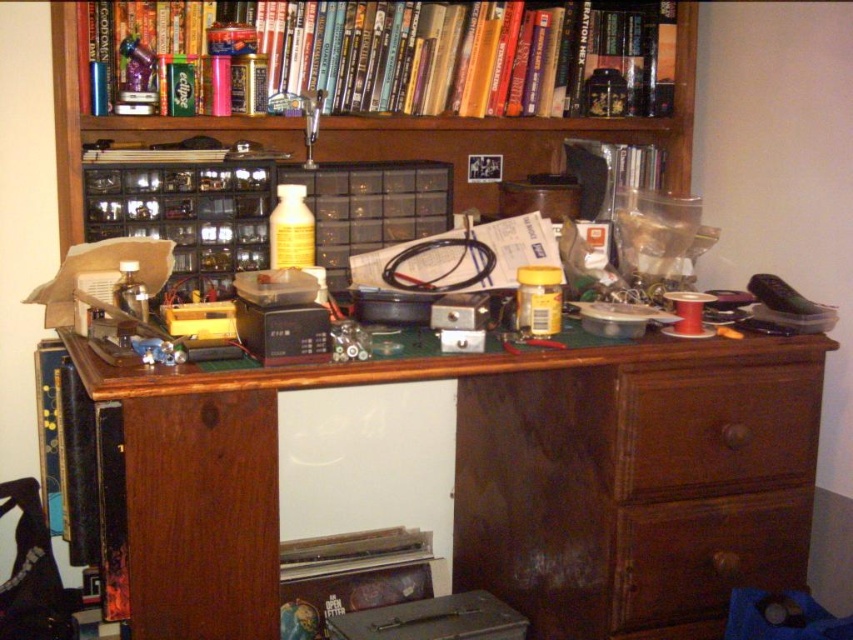
You are organizing the desk and want to place a new tool between the brown wood drawer at right and the yellow matte bottle at center. Based on their current positions, which object should you move closer to the center to create space?

The brown wood drawer at right is positioned on the right side of the yellow matte bottle at center. To create space between them, you should move the brown wood drawer at right closer to the center.

Looking at this image, you are organizing the desk and want to place a new item between the brown wood drawer at right and the yellow matte bottle at center. Based on their positions, which object is closer to you so you can place the item in between?

The brown wood drawer at right is in front of the yellow matte bottle at center, so you should place the new item between the brown wood drawer at right and the yellow matte bottle at center by positioning it closer to the drawer since it is nearer to you.

You are organizing the desk and need to place a new item that requires a larger space. Which object between the hardcover book at upper center and the wooden drawer at lower right should you place it next to?

The hardcover book at upper center is larger than the wooden drawer at lower right, so you should place the new item next to the hardcover book at upper center to accommodate its size.